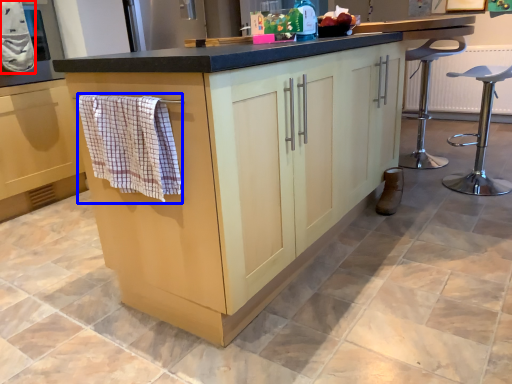
Question: Which of the following is the closest to the observer, bath towel (highlighted by a red box) or bath towel (highlighted by a blue box)?

Choices:
 (A) bath towel
 (B) bath towel

Answer: (B)